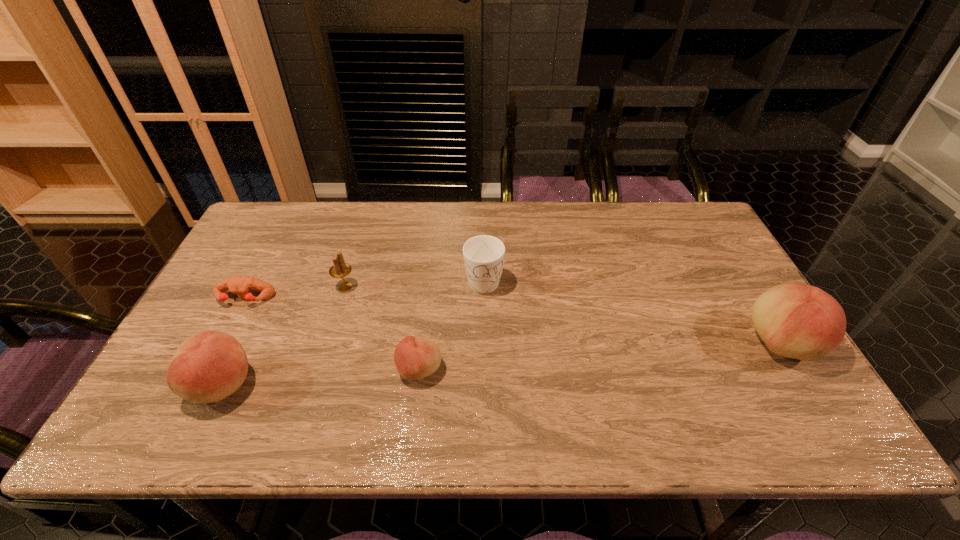
You are a GUI agent. You are given a task and a screenshot of the screen. Output one action in this format:
    pyautogui.click(x=<x>, y=<y>)
    Task: Click on the vacant space that's between the shortest object and the mug
    The image size is (960, 540).
    Given the screenshot: What is the action you would take?
    pyautogui.click(x=364, y=289)

This screenshot has height=540, width=960. I want to click on vacant region between the rightmost object and the candle holder, so click(564, 315).

Image resolution: width=960 pixels, height=540 pixels. I want to click on the third closest object to the second shortest object, so [209, 366].

At what (x,y) coordinates should I click in order to perform the action: click on object that stands as the second closest to the mug. Please return your answer as a coordinate pair (x, y). Looking at the image, I should click on (340, 269).

Locate which peach ranks in proximity to the second object from right to left. Please provide its 2D coordinates. Your answer should be formatted as a tuple, i.e. [(x, y)], where the tuple contains the x and y coordinates of a point satisfying the conditions above.

[(415, 358)]

Find the location of `peach that is the second closest to the rightmost peach`. peach that is the second closest to the rightmost peach is located at coordinates (209, 366).

At what (x,y) coordinates should I click in order to perform the action: click on free space that satisfies the following two spatial constraints: 1. on the back side of the second shortest peach; 2. on the right side of the candle holder. Please return your answer as a coordinate pair (x, y). Looking at the image, I should click on (270, 287).

Locate an element on the screen. vacant space that satisfies the following two spatial constraints: 1. on the front side of the fourth object from right to left; 2. on the right side of the rightmost peach is located at coordinates (327, 343).

At what (x,y) coordinates should I click in order to perform the action: click on free spot that satisfies the following two spatial constraints: 1. with the gloves of the puncher facing forward; 2. on the left side of the second peach from left to right. Please return your answer as a coordinate pair (x, y). This screenshot has height=540, width=960. Looking at the image, I should click on (207, 370).

This screenshot has height=540, width=960. I want to click on vacant region that satisfies the following two spatial constraints: 1. with the gloves of the second shortest peach facing forward; 2. on the right side of the shortest object, so click(200, 384).